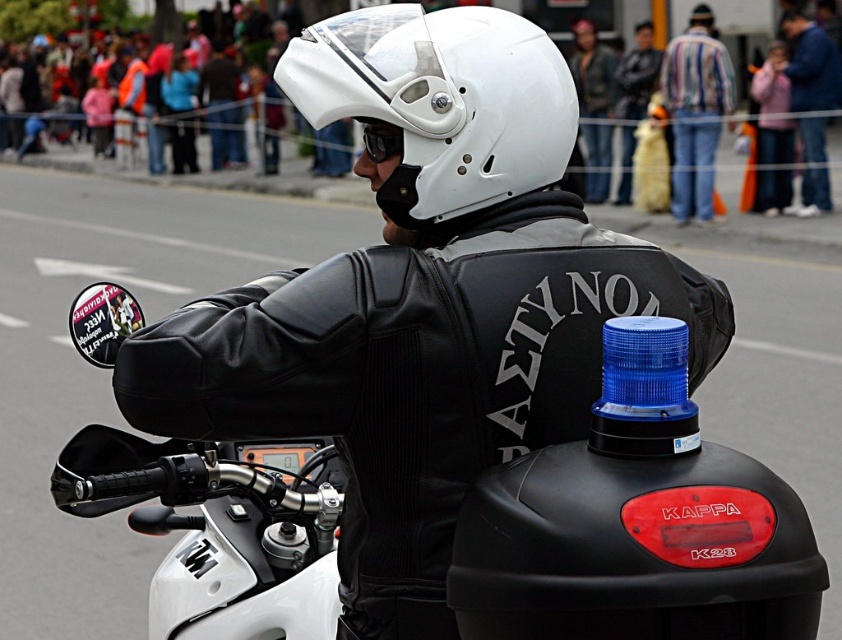
Is white matte helmet at center above striped shirt at center?

Actually, white matte helmet at center is below striped shirt at center.

Which is more to the left, white matte helmet at center or striped shirt at center?

Positioned to the left is white matte helmet at center.

Locate an element on the screen. The width and height of the screenshot is (842, 640). white matte helmet at center is located at coordinates (441, 100).

Who is shorter, matte black jacket at center or blue denim jacket at upper right?

matte black jacket at center is shorter.

This screenshot has width=842, height=640. I want to click on matte black jacket at center, so click(x=422, y=300).

Can you confirm if white matte helmet at center is taller than blue denim jacket at upper right?

No, white matte helmet at center is not taller than blue denim jacket at upper right.

Which is behind, point (525, 24) or point (784, 20)?

Point (784, 20)

In order to click on white matte helmet at center in this screenshot , I will do `click(441, 100)`.